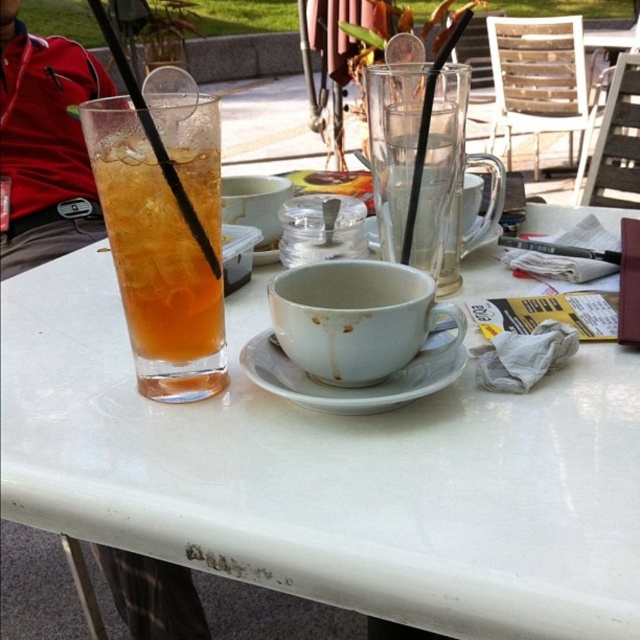
Between point (128, 284) and point (193, 588), which one is positioned in front?

Point (128, 284)

In the scene shown: How distant is translucent glass drink at left from red fabric jacket at left?

translucent glass drink at left is 1.03 meters away from red fabric jacket at left.

Does point (195, 154) lie behind point (36, 220)?

No.

Where is `translucent glass drink at left`? translucent glass drink at left is located at coordinates (163, 237).

Which is more to the right, red fabric jacket at left or white ceramic saucer at center?

white ceramic saucer at center

Is red fabric jacket at left wider than white ceramic saucer at center?

Yes.

Is point (134, 636) farther from viewer compared to point (376, 403)?

Yes, it is behind point (376, 403).

Locate an element on the screen. The image size is (640, 640). red fabric jacket at left is located at coordinates (44, 145).

Between transparent glass cup at upper left and red fabric jacket at left, which one has more height?

red fabric jacket at left

Describe the element at coordinates (330, 476) in the screenshot. I see `transparent glass cup at upper left` at that location.

The width and height of the screenshot is (640, 640). In order to click on transparent glass cup at upper left in this screenshot , I will do `click(330, 476)`.